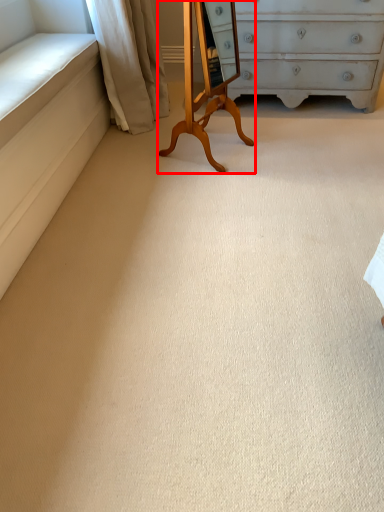
Question: From the image's perspective, what is the correct spatial positioning of changing table (annotated by the red box) in reference to curtain?

Choices:
 (A) above
 (B) below

Answer: (B)